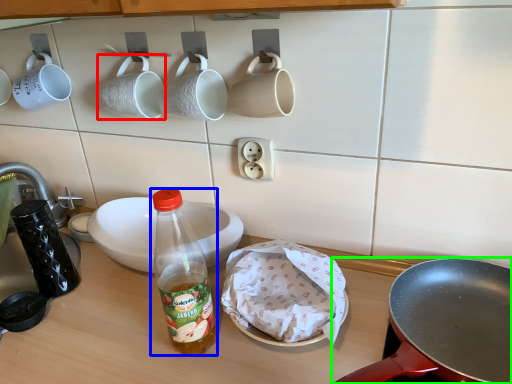
Question: Considering the real-world distances, which object is farthest from coffee cup (highlighted by a red box)? bottle (highlighted by a blue box) or frying pan (highlighted by a green box)?

Choices:
 (A) bottle
 (B) frying pan

Answer: (B)